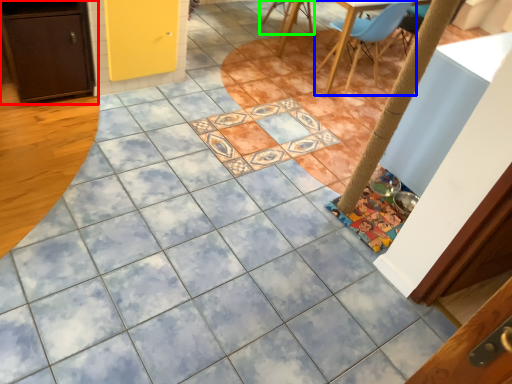
Question: Estimate the real-world distances between objects in this image. Which object is farther from cabinetry (highlighted by a red box), chair (highlighted by a blue box) or chair (highlighted by a green box)?

Choices:
 (A) chair
 (B) chair

Answer: (B)